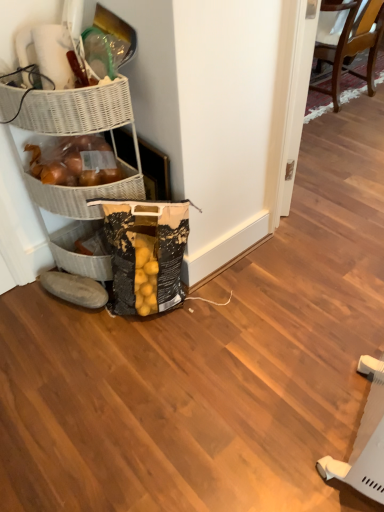
In order to click on unoccupied region to the right of black textured grocery bag at lower left in this screenshot , I will do `click(221, 311)`.